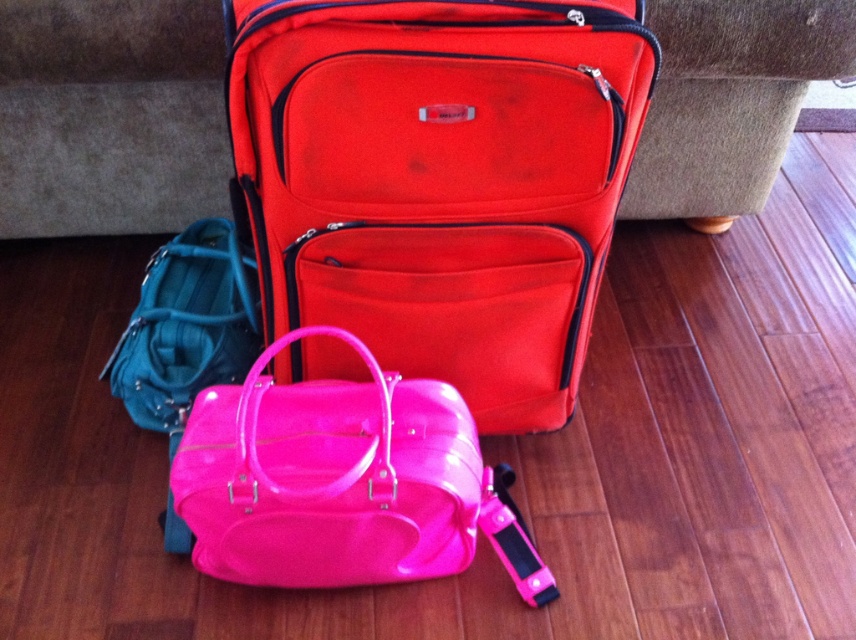
You are standing in front of the travel bags and want to place a small item on the point closer to you between point (490, 177) and point (227, 272). Which point should you choose?

Point (490, 177) is in front of point (227, 272), so you should choose point (490, 177) as it is closer to you.